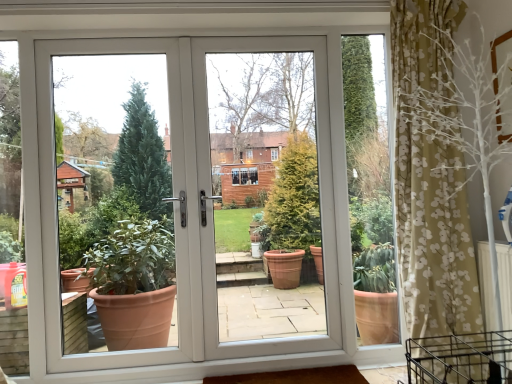
Question: Should I look upward or downward to see white plastic door at center?

Choices:
 (A) down
 (B) up

Answer: (A)

Question: Does white plastic door at center turn towards white plastic door at center?

Choices:
 (A) yes
 (B) no

Answer: (A)

Question: Is white plastic door at center positioned beyond the bounds of white plastic door at center?

Choices:
 (A) no
 (B) yes

Answer: (A)

Question: Are white plastic door at center and white plastic door at center located far from each other?

Choices:
 (A) no
 (B) yes

Answer: (A)

Question: Is white plastic door at center smaller than white plastic door at center?

Choices:
 (A) yes
 (B) no

Answer: (A)

Question: Is white plastic door at center wider than white plastic door at center?

Choices:
 (A) yes
 (B) no

Answer: (B)

Question: Can you confirm if white plastic door at center is positioned to the right of white plastic door at center?

Choices:
 (A) yes
 (B) no

Answer: (A)

Question: Considering the relative sizes of white plastic door at center and white plastic door at center in the image provided, is white plastic door at center thinner than white plastic door at center?

Choices:
 (A) no
 (B) yes

Answer: (A)

Question: From the image's perspective, is white plastic door at center below white plastic door at center?

Choices:
 (A) no
 (B) yes

Answer: (B)

Question: Is white plastic door at center a part of white plastic door at center?

Choices:
 (A) no
 (B) yes

Answer: (B)

Question: Is white plastic door at center not close to white plastic door at center?

Choices:
 (A) yes
 (B) no

Answer: (B)

Question: Is the depth of white plastic door at center less than that of white plastic door at center?

Choices:
 (A) no
 (B) yes

Answer: (B)

Question: Is white plastic door at center oriented towards white plastic door at center?

Choices:
 (A) yes
 (B) no

Answer: (A)

Question: Looking at the image, does white plastic door at center seem bigger or smaller compared to white plastic door at center?

Choices:
 (A) small
 (B) big

Answer: (A)